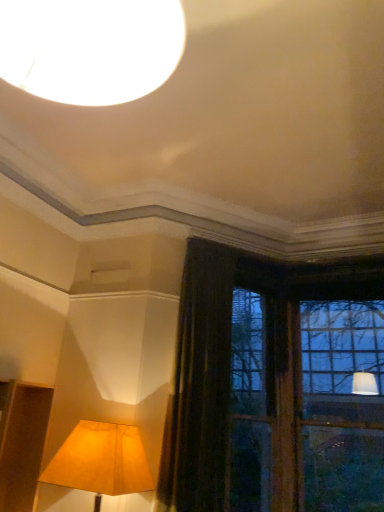
What do you see at coordinates (101, 461) in the screenshot? Image resolution: width=384 pixels, height=512 pixels. I see `matte yellow fabric lampshade at lower left` at bounding box center [101, 461].

You are a GUI agent. You are given a task and a screenshot of the screen. Output one action in this format:
    pyautogui.click(x=<x>, y=<y>)
    Task: Click on the matte yellow fabric lampshade at lower left
    The height and width of the screenshot is (512, 384).
    Given the screenshot: What is the action you would take?
    101,461

Measure the distance between point (x=220, y=394) and camera.

11.03 feet.

Where is `dark velvet curtain at center`? The image size is (384, 512). dark velvet curtain at center is located at coordinates (199, 385).

Describe the element at coordinates (199, 385) in the screenshot. This screenshot has height=512, width=384. I see `dark velvet curtain at center` at that location.

This screenshot has width=384, height=512. What are the coordinates of `matte yellow fabric lampshade at lower left` in the screenshot? It's located at (101, 461).

Based on the photo, considering the relative positions of matte yellow fabric lampshade at lower left and dark velvet curtain at center in the image provided, is matte yellow fabric lampshade at lower left to the left of dark velvet curtain at center from the viewer's perspective?

Yes, matte yellow fabric lampshade at lower left is to the left of dark velvet curtain at center.

Does matte yellow fabric lampshade at lower left lie in front of dark velvet curtain at center?

That is True.

From the picture: Which is closer to the camera, (77, 471) or (183, 393)?

Point (77, 471) is closer to the camera than point (183, 393).

Based on the photo, from the image's perspective, which is below, matte yellow fabric lampshade at lower left or dark velvet curtain at center?

From the image's view, matte yellow fabric lampshade at lower left is below.

From a real-world perspective, between matte yellow fabric lampshade at lower left and dark velvet curtain at center, who is vertically lower?

From a 3D spatial view, matte yellow fabric lampshade at lower left is below.

Between matte yellow fabric lampshade at lower left and dark velvet curtain at center, which one has smaller width?

Thinner between the two is dark velvet curtain at center.

In terms of height, does matte yellow fabric lampshade at lower left look taller or shorter compared to dark velvet curtain at center?

In the image, matte yellow fabric lampshade at lower left appears to be shorter than dark velvet curtain at center.

Between matte yellow fabric lampshade at lower left and dark velvet curtain at center, which one has larger size?

dark velvet curtain at center.

Is matte yellow fabric lampshade at lower left outside of dark velvet curtain at center?

Indeed, matte yellow fabric lampshade at lower left is completely outside dark velvet curtain at center.

Does matte yellow fabric lampshade at lower left touch dark velvet curtain at center?

No, matte yellow fabric lampshade at lower left is not next to dark velvet curtain at center.

Could you tell me if matte yellow fabric lampshade at lower left is turned towards dark velvet curtain at center?

No, matte yellow fabric lampshade at lower left is not facing towards dark velvet curtain at center.

How many degrees apart are the facing directions of matte yellow fabric lampshade at lower left and dark velvet curtain at center?

The facing directions of matte yellow fabric lampshade at lower left and dark velvet curtain at center are 43.8 degrees apart.

Where is `lamp below the dark velvet curtain at center (from the image's perspective)`? The image size is (384, 512). lamp below the dark velvet curtain at center (from the image's perspective) is located at coordinates (101, 461).

Which object is positioned more to the left, dark velvet curtain at center or matte yellow fabric lampshade at lower left?

matte yellow fabric lampshade at lower left is more to the left.

Is dark velvet curtain at center in front of or behind matte yellow fabric lampshade at lower left in the image?

Visually, dark velvet curtain at center is located behind matte yellow fabric lampshade at lower left.

Which point is more distant from viewer, (180, 463) or (108, 426)?

The point (180, 463) is farther.

From the image's perspective, is dark velvet curtain at center located above matte yellow fabric lampshade at lower left?

Indeed, from the image's perspective, dark velvet curtain at center is shown above matte yellow fabric lampshade at lower left.

In the scene shown: From a real-world perspective, is dark velvet curtain at center under matte yellow fabric lampshade at lower left?

No, from a real-world perspective, dark velvet curtain at center is not under matte yellow fabric lampshade at lower left.

Which of these two, dark velvet curtain at center or matte yellow fabric lampshade at lower left, is thinner?

Thinner between the two is dark velvet curtain at center.

Which of these two, dark velvet curtain at center or matte yellow fabric lampshade at lower left, stands taller?

dark velvet curtain at center is taller.

Is dark velvet curtain at center smaller than matte yellow fabric lampshade at lower left?

No, dark velvet curtain at center is not smaller than matte yellow fabric lampshade at lower left.

Is matte yellow fabric lampshade at lower left completely or partially inside dark velvet curtain at center?

No, dark velvet curtain at center does not contain matte yellow fabric lampshade at lower left.

Is dark velvet curtain at center far away from matte yellow fabric lampshade at lower left?

No, dark velvet curtain at center is not far from matte yellow fabric lampshade at lower left.

Does dark velvet curtain at center turn towards matte yellow fabric lampshade at lower left?

No, dark velvet curtain at center is not turned towards matte yellow fabric lampshade at lower left.

How different are the orientations of dark velvet curtain at center and matte yellow fabric lampshade at lower left in degrees?

dark velvet curtain at center and matte yellow fabric lampshade at lower left are facing 43.8 degrees away from each other.

Where is `lamp on the left of the dark velvet curtain at center`? lamp on the left of the dark velvet curtain at center is located at coordinates (101, 461).

At what (x,y) coordinates should I click in order to perform the action: click on curtain above the matte yellow fabric lampshade at lower left (from a real-world perspective). Please return your answer as a coordinate pair (x, y). This screenshot has height=512, width=384. Looking at the image, I should click on (199, 385).

Locate an element on the screen. lamp that appears below the dark velvet curtain at center (from the image's perspective) is located at coordinates (101, 461).